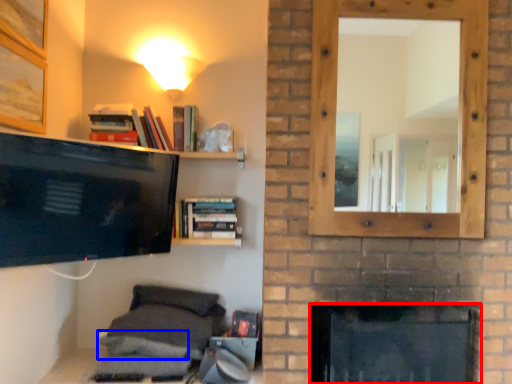
Question: Which point is closer to the camera, fireplace (highlighted by a red box) or pillow (highlighted by a blue box)?

Choices:
 (A) fireplace
 (B) pillow

Answer: (A)